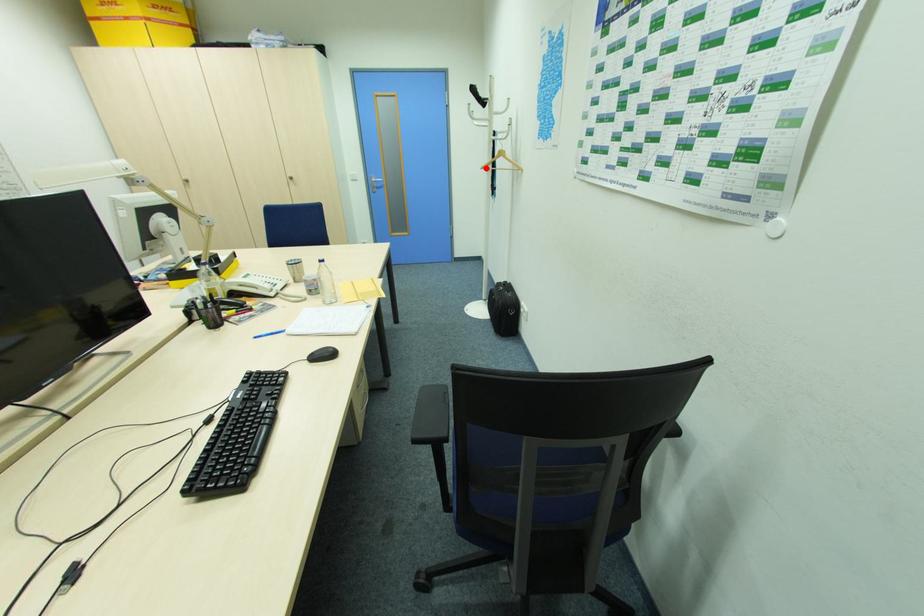
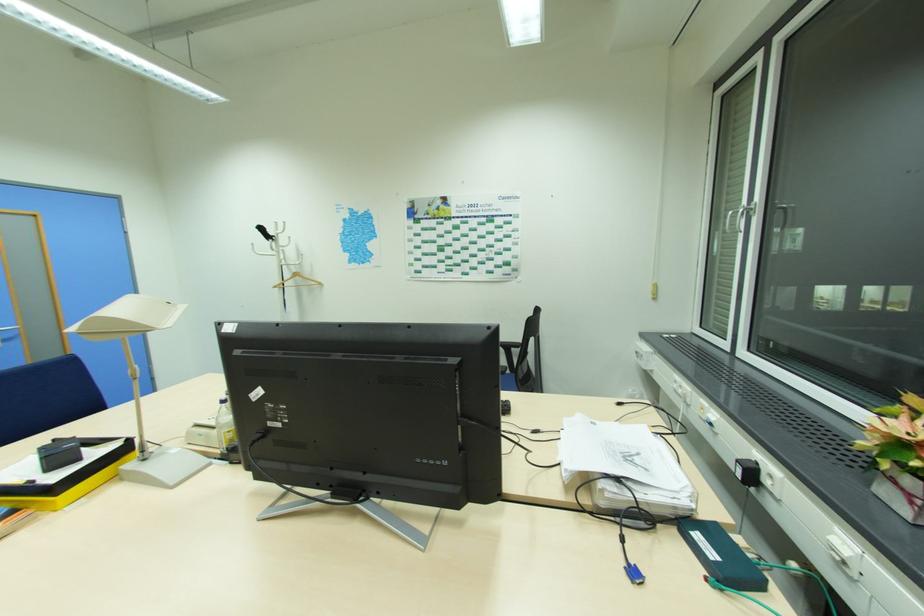
In the second image, find the point that corresponds to the highlighted location in the first image.

(277, 286)